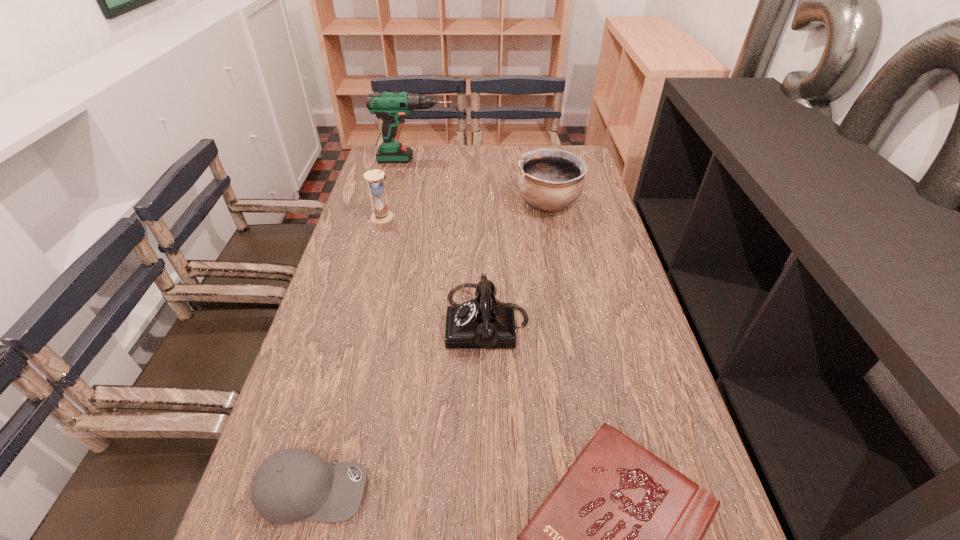
Choose which object is the fourth nearest neighbor to the pottery. Please provide its 2D coordinates. Your answer should be formatted as a tuple, i.e. [(x, y)], where the tuple contains the x and y coordinates of a point satisfying the conditions above.

[(620, 538)]

Find the location of a particular element. free space that satisfies the following two spatial constraints: 1. on the handle side of the drill; 2. on the front side of the hourglass is located at coordinates (403, 217).